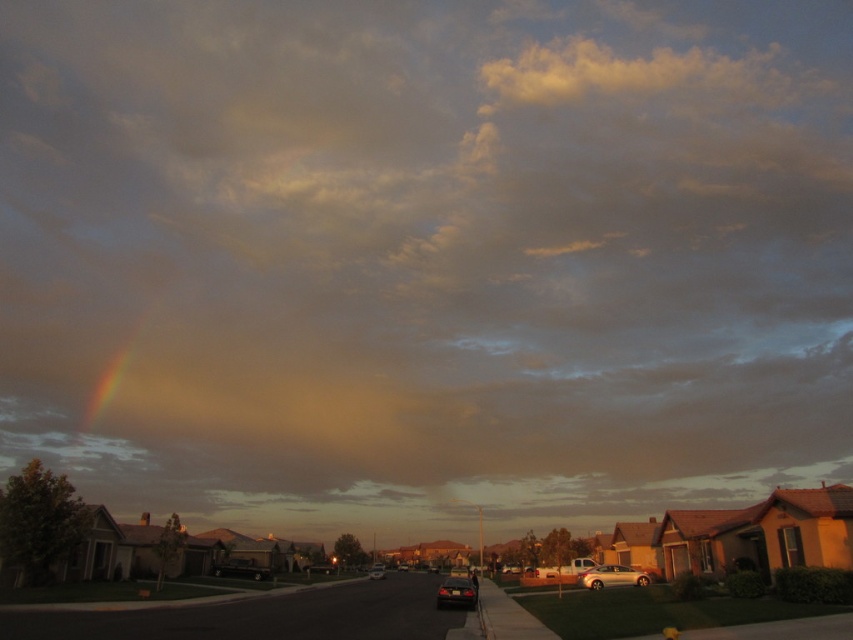
You are a delivery person who needs to park a 2.5 meters tall truck. You see the metallic silver sedan at center and the shiny black sedan at center in the driveway. Which one is taller and can the truck fit between them?

The metallic silver sedan at center is much taller than the shiny black sedan at center. However, since the truck is 2.5 meters tall and the tallest object mentioned is the metallic silver sedan, which is not specified to be taller than 2.5 meters, it is uncertain if the truck can fit. Please check the exact height of the metallic silver sedan before deciding.

You are driving a car and want to pass between the satin silver sedan at center and the shiny black sedan at center. Is there enough space between them for your car?

The satin silver sedan at center is closer to the viewer than the shiny black sedan at center, so there is space between them for your car to pass through.

You are a delivery driver who needs to park your vehicle between the satin silver sedan at center and the shiny black sedan at center. The parking space between them can accommodate a vehicle of what maximum length?

The distance between the satin silver sedan at center and the shiny black sedan at center is 88.85 meters. Since the parking space is the distance between them, the maximum length of a vehicle that can be parked there is 88.85 meters.